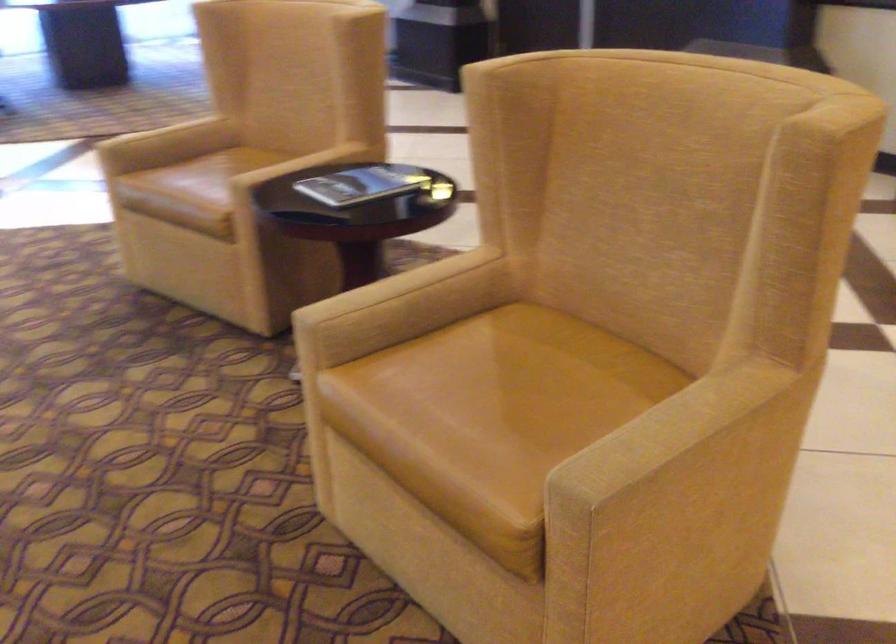
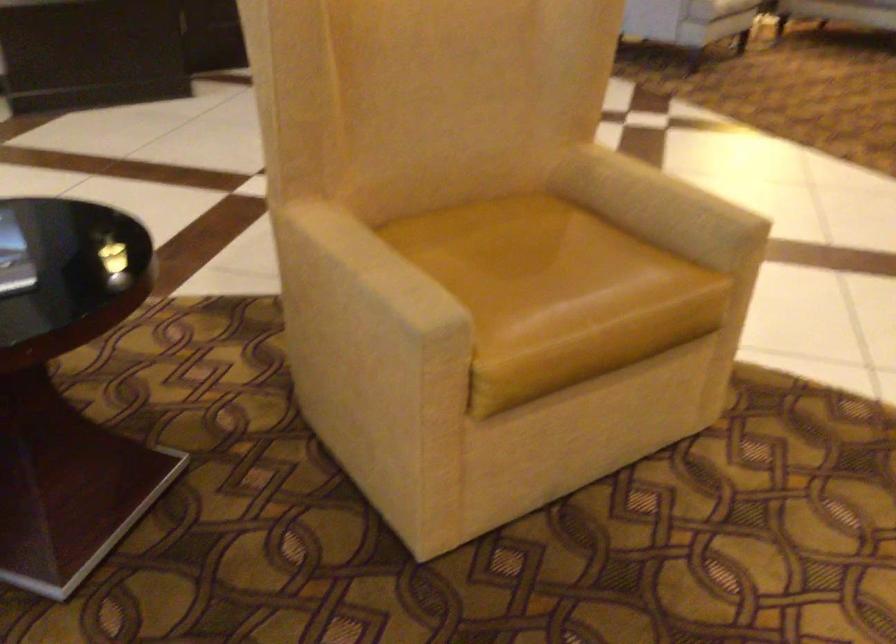
In the second image, find the point that corresponds to (398,290) in the first image.

(375, 266)